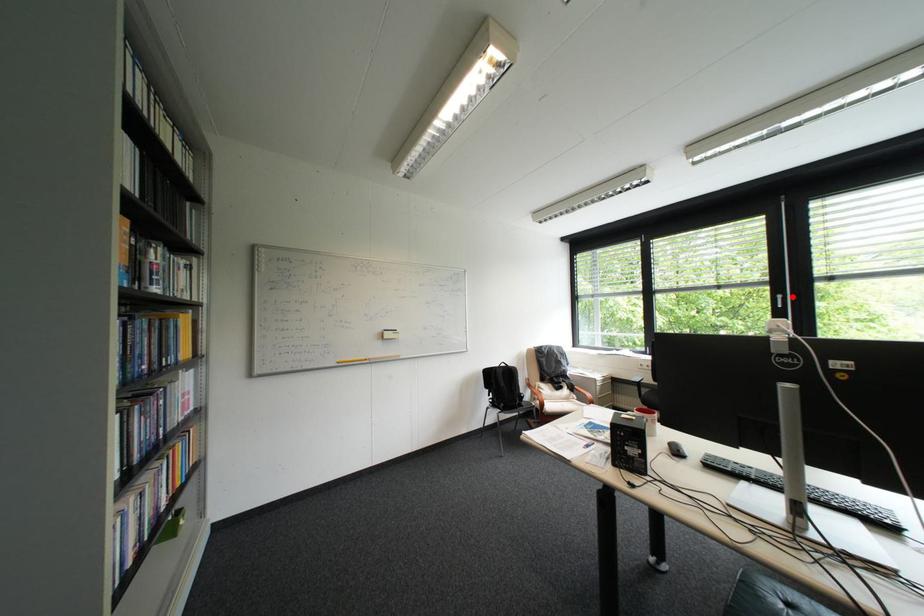
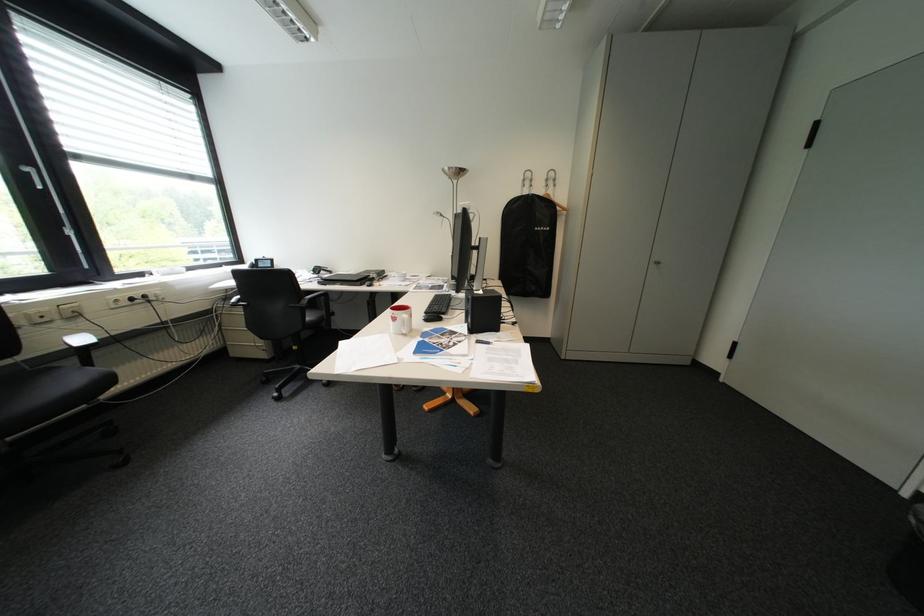
In the second image, find the point that corresponds to the highlighted location in the first image.

(41, 169)